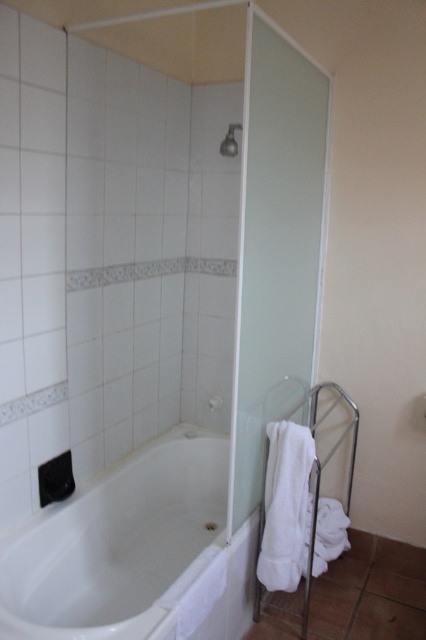
Can you confirm if white glossy bathtub at lower left is taller than satin silver faucet at upper center?

Indeed, white glossy bathtub at lower left has a greater height compared to satin silver faucet at upper center.

Where is `white glossy bathtub at lower left`? The image size is (426, 640). white glossy bathtub at lower left is located at coordinates (117, 545).

Is point (134, 624) more distant than point (226, 141)?

No.

Where is `white glossy bathtub at lower left`? white glossy bathtub at lower left is located at coordinates (117, 545).

How far apart are transparent frosted glass door at right and satin silver faucet at upper center?

transparent frosted glass door at right is 67.73 centimeters away from satin silver faucet at upper center.

Is transparent frosted glass door at right positioned at the back of satin silver faucet at upper center?

No, transparent frosted glass door at right is closer to the viewer.

This screenshot has width=426, height=640. What do you see at coordinates (275, 248) in the screenshot? I see `transparent frosted glass door at right` at bounding box center [275, 248].

Locate an element on the screen. This screenshot has width=426, height=640. transparent frosted glass door at right is located at coordinates (275, 248).

Between white glossy bathtub at lower left and transparent frosted glass door at right, which one appears on the left side from the viewer's perspective?

white glossy bathtub at lower left is more to the left.

Is point (14, 576) positioned behind point (310, 81)?

No, it is not.

You are a GUI agent. You are given a task and a screenshot of the screen. Output one action in this format:
    pyautogui.click(x=<x>, y=<y>)
    Task: Click on the white glossy bathtub at lower left
    The image size is (426, 640).
    Given the screenshot: What is the action you would take?
    pyautogui.click(x=117, y=545)